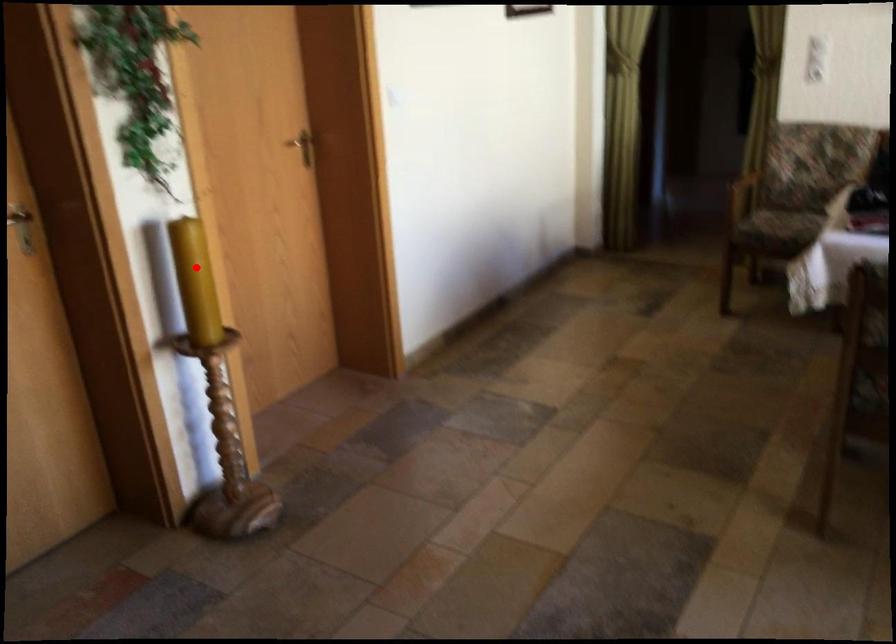
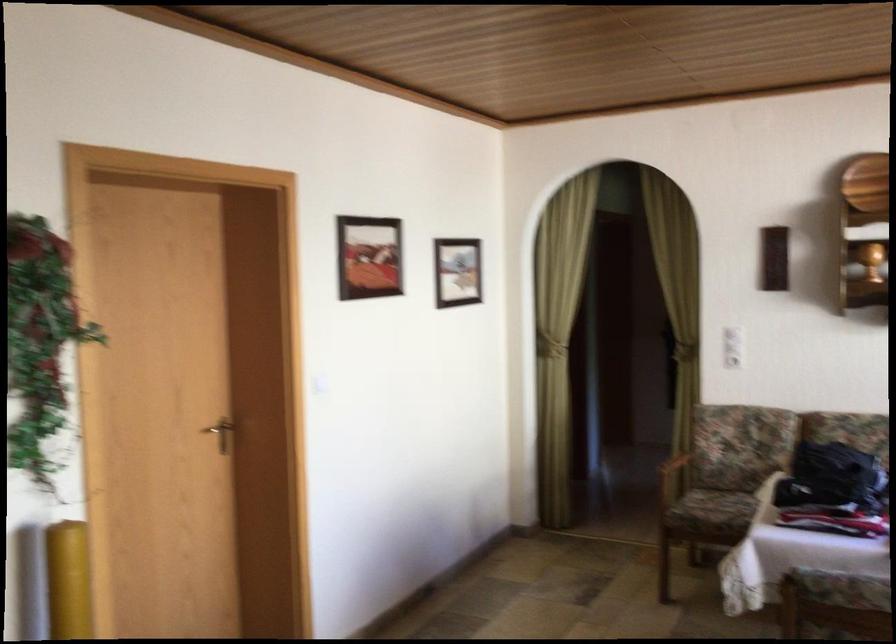
In the second image, find the point that corresponds to the highlighted location in the first image.

(67, 580)